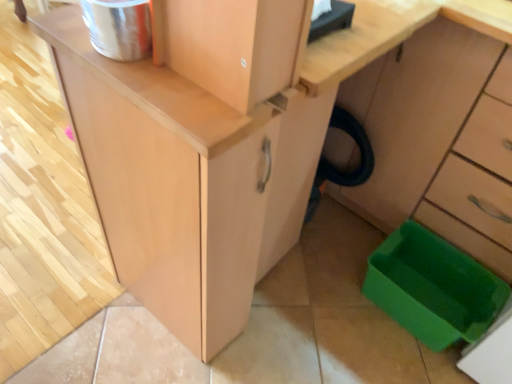
Question: Does green plastic trash can at lower right appear on the left side of green plastic storage box at lower right?

Choices:
 (A) no
 (B) yes

Answer: (A)

Question: Is green plastic trash can at lower right not near green plastic storage box at lower right?

Choices:
 (A) yes
 (B) no

Answer: (B)

Question: From a real-world perspective, is green plastic trash can at lower right located beneath green plastic storage box at lower right?

Choices:
 (A) yes
 (B) no

Answer: (B)

Question: From the image's perspective, is green plastic trash can at lower right on top of green plastic storage box at lower right?

Choices:
 (A) yes
 (B) no

Answer: (A)

Question: Is green plastic trash can at lower right facing away from green plastic storage box at lower right?

Choices:
 (A) yes
 (B) no

Answer: (B)

Question: Could you tell me if green plastic trash can at lower right is facing green plastic storage box at lower right?

Choices:
 (A) yes
 (B) no

Answer: (A)

Question: From the image's perspective, is green plastic storage box at lower right located above green plastic trash can at lower right?

Choices:
 (A) yes
 (B) no

Answer: (B)

Question: Is green plastic trash can at lower right at the back of green plastic storage box at lower right?

Choices:
 (A) yes
 (B) no

Answer: (A)

Question: Is green plastic storage box at lower right in contact with green plastic trash can at lower right?

Choices:
 (A) yes
 (B) no

Answer: (B)

Question: Is green plastic storage box at lower right smaller than green plastic trash can at lower right?

Choices:
 (A) no
 (B) yes

Answer: (B)

Question: Is green plastic storage box at lower right shorter than green plastic trash can at lower right?

Choices:
 (A) yes
 (B) no

Answer: (A)

Question: Does green plastic storage box at lower right appear on the left side of green plastic trash can at lower right?

Choices:
 (A) yes
 (B) no

Answer: (A)

Question: Is point (433, 347) closer or farther from the camera than point (449, 190)?

Choices:
 (A) farther
 (B) closer

Answer: (B)